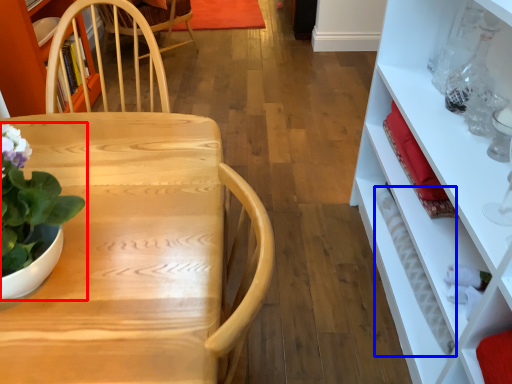
Question: Which object is closer to the camera taking this photo, houseplant (highlighted by a red box) or bottle (highlighted by a blue box)?

Choices:
 (A) houseplant
 (B) bottle

Answer: (A)